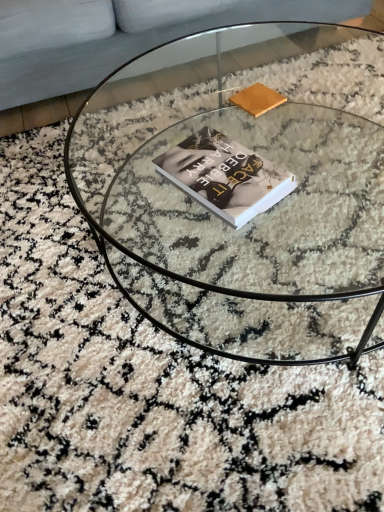
Question: Does transparent glass coffee table at center have a greater height compared to matte brown book at upper center?

Choices:
 (A) yes
 (B) no

Answer: (A)

Question: From a real-world perspective, does transparent glass coffee table at center stand above matte brown book at upper center?

Choices:
 (A) yes
 (B) no

Answer: (B)

Question: Is transparent glass coffee table at center facing away from matte brown book at upper center?

Choices:
 (A) yes
 (B) no

Answer: (B)

Question: Considering the relative sizes of transparent glass coffee table at center and matte brown book at upper center in the image provided, is transparent glass coffee table at center smaller than matte brown book at upper center?

Choices:
 (A) yes
 (B) no

Answer: (B)

Question: Is transparent glass coffee table at center far away from matte brown book at upper center?

Choices:
 (A) yes
 (B) no

Answer: (B)

Question: Would you say transparent glass coffee table at center contains matte brown book at upper center?

Choices:
 (A) yes
 (B) no

Answer: (A)

Question: Considering the relative sizes of light gray fabric couch at upper left and matte brown book at upper center in the image provided, is light gray fabric couch at upper left taller than matte brown book at upper center?

Choices:
 (A) yes
 (B) no

Answer: (A)

Question: Can you confirm if light gray fabric couch at upper left is thinner than matte brown book at upper center?

Choices:
 (A) no
 (B) yes

Answer: (A)

Question: Is light gray fabric couch at upper left not near matte brown book at upper center?

Choices:
 (A) no
 (B) yes

Answer: (A)

Question: From the image's perspective, is light gray fabric couch at upper left located above matte brown book at upper center?

Choices:
 (A) yes
 (B) no

Answer: (A)

Question: Is light gray fabric couch at upper left in front of matte brown book at upper center?

Choices:
 (A) yes
 (B) no

Answer: (B)

Question: Does light gray fabric couch at upper left turn towards matte brown book at upper center?

Choices:
 (A) no
 (B) yes

Answer: (B)

Question: Does hardcover book at center appear on the right side of matte brown book at upper center?

Choices:
 (A) yes
 (B) no

Answer: (B)